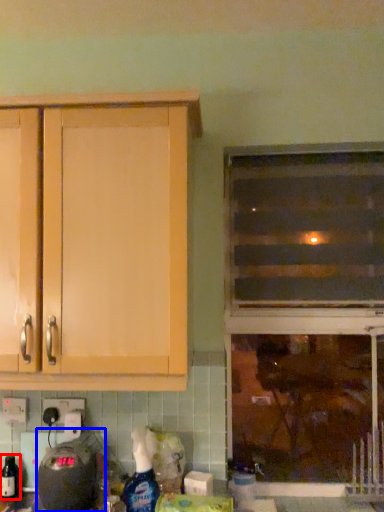
Question: Which point is further to the camera, bottle (highlighted by a red box) or appliance (highlighted by a blue box)?

Choices:
 (A) bottle
 (B) appliance

Answer: (A)